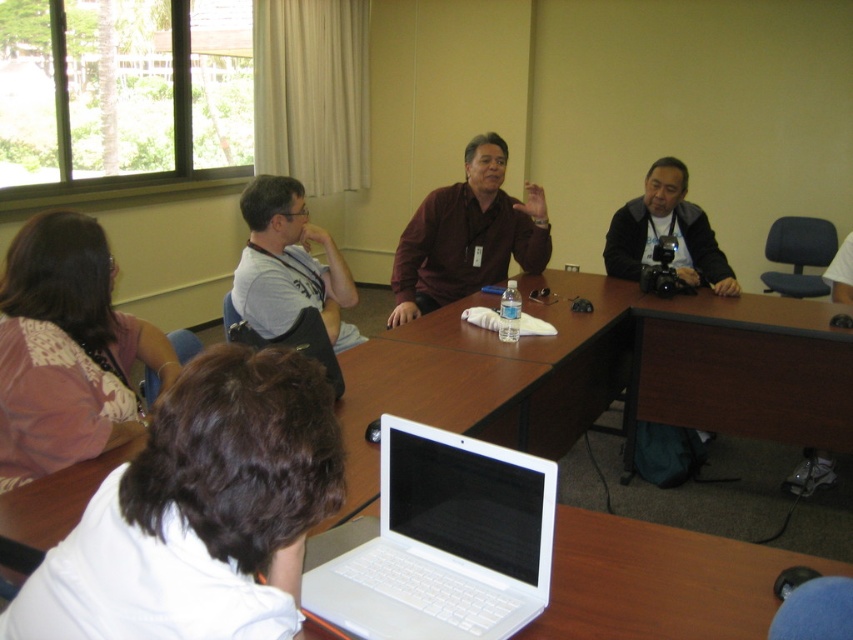
You are a photographer who needs to capture a clear shot of the pink floral blouse at lower left and the black matte camera at right. Which object should you focus on first if you want to ensure both are in focus without adjusting the camera settings?

The pink floral blouse at lower left is shorter than the black matte camera at right. To keep both in focus, you should focus on the black matte camera at right first since it is taller, ensuring the depth of field captures the shorter blouse as well.

You are standing in front of the table and want to place a small object on the table. You have two options to choose from, either placing it at point (171, 372) or point (695, 221). Which point is closer to you?

Point (171, 372) is closer to the viewer than point (695, 221), so you should place the object there.

You are a participant in the meeting and need to reach for the white plastic laptop at center to share a document. However, there is a matte brown shirt at center blocking your view. Can you still access the laptop without moving the shirt?

The white plastic laptop at center is closer to the viewer than the matte brown shirt at center, so you can access the laptop without needing to move the shirt since it is in front of the shirt.